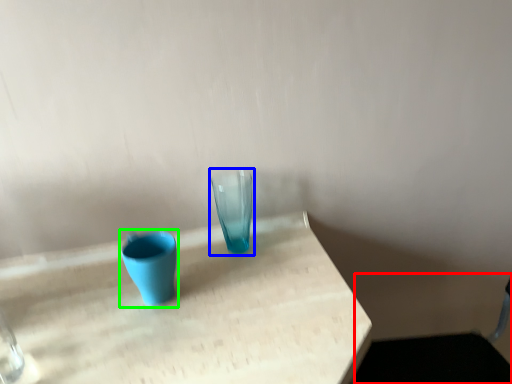
Question: Which is farther away from swivel chair (highlighted by a red box)? vase (highlighted by a blue box) or vase (highlighted by a green box)?

Choices:
 (A) vase
 (B) vase

Answer: (B)